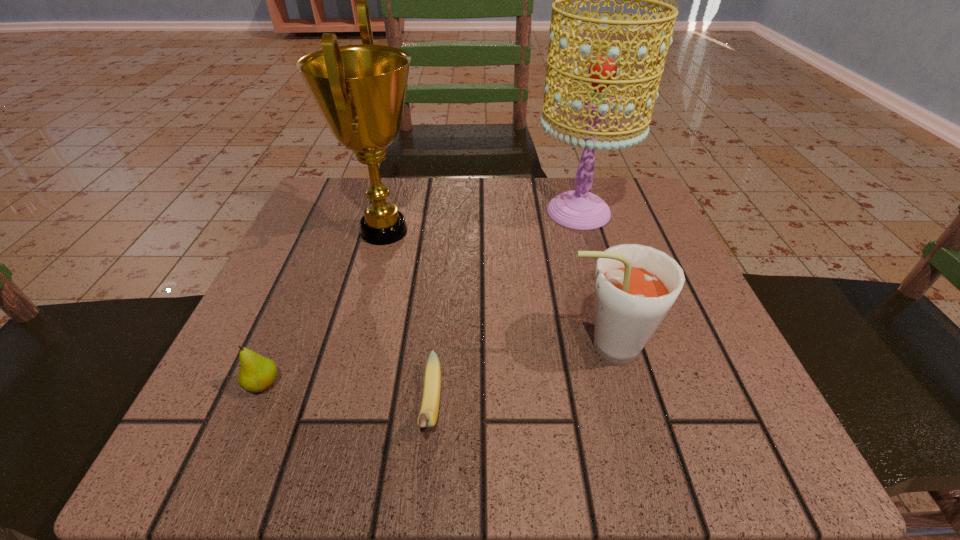
You are a GUI agent. You are given a task and a screenshot of the screen. Output one action in this format:
    pyautogui.click(x=<x>, y=<y>)
    Task: Click on the vacant area located 0.190m on the drink side of the third shortest object
    This screenshot has height=540, width=960.
    Given the screenshot: What is the action you would take?
    pyautogui.click(x=432, y=347)

Where is `free space located 0.060m on the drink side of the third shortest object`? This screenshot has height=540, width=960. free space located 0.060m on the drink side of the third shortest object is located at coordinates (517, 347).

Image resolution: width=960 pixels, height=540 pixels. I want to click on free point located 0.150m on the back of the leftmost object, so click(300, 298).

In order to click on lampshade positioned at the far edge in this screenshot , I will do `click(579, 209)`.

Image resolution: width=960 pixels, height=540 pixels. In order to click on award that is at the far edge in this screenshot , I will do tap(360, 90).

The image size is (960, 540). I want to click on object present at the near edge, so click(x=428, y=415).

Locate an element on the screen. The width and height of the screenshot is (960, 540). award present at the left edge is located at coordinates (360, 90).

You are a GUI agent. You are given a task and a screenshot of the screen. Output one action in this format:
    pyautogui.click(x=<x>, y=<y>)
    Task: Click on the pear present at the left edge
    The height and width of the screenshot is (540, 960).
    Given the screenshot: What is the action you would take?
    pyautogui.click(x=257, y=373)

Where is `lampshade present at the right edge`? The image size is (960, 540). lampshade present at the right edge is located at coordinates (579, 209).

Where is `root beer positioned at the right edge`? root beer positioned at the right edge is located at coordinates click(x=635, y=286).